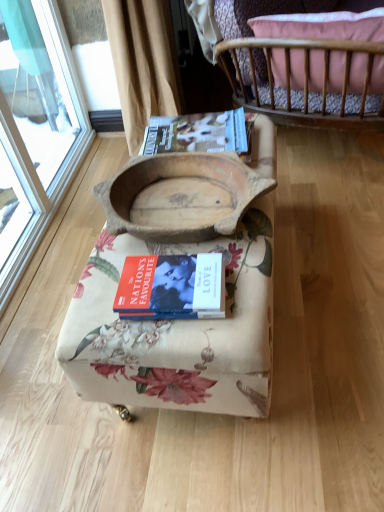
This screenshot has height=512, width=384. Identify the location of vacant space in between hardcover book at center and wooden bowl at center. (120, 274).